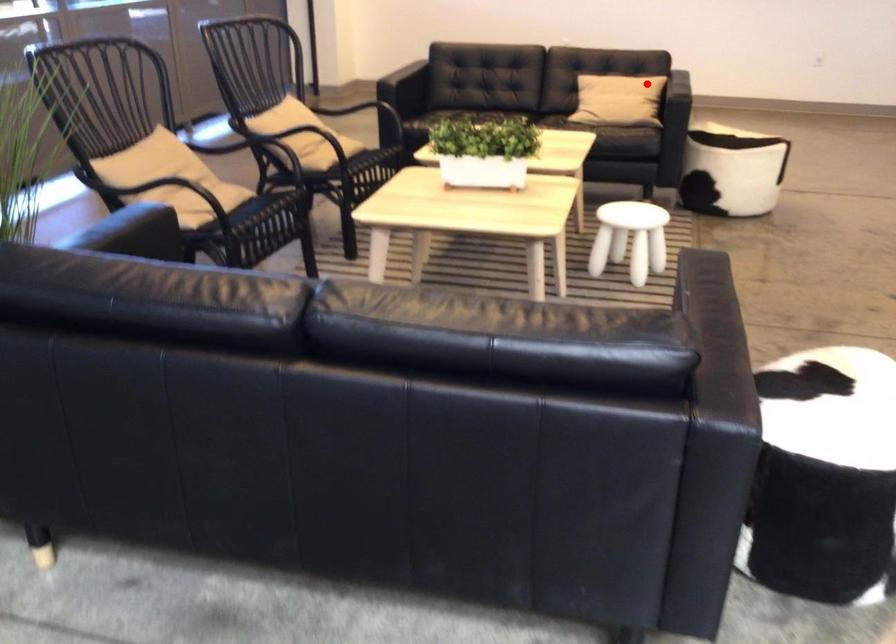
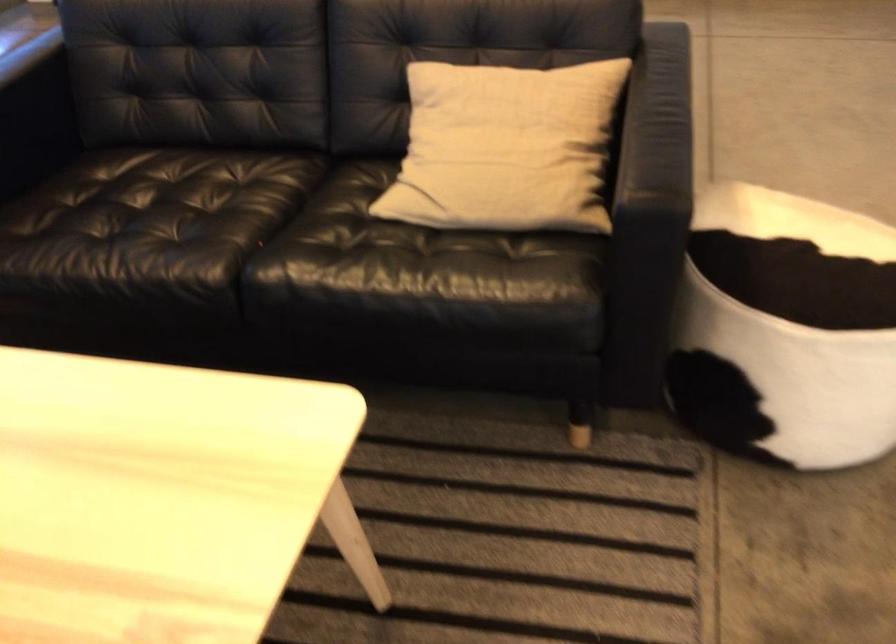
Question: I am providing you with two images of the same scene from different viewpoints. Image1 has a red point marked. In image2, the corresponding 3D location appears at what relative position? Reply with the corresponding letter.

Choices:
 (A) Closer
 (B) Farther

Answer: (A)